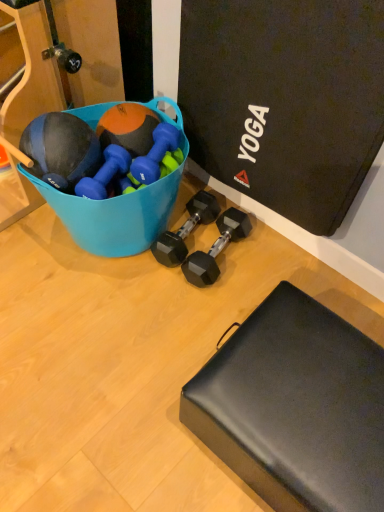
Describe the element at coordinates (158, 154) in the screenshot. Image resolution: width=384 pixels, height=512 pixels. I see `blue rubber dumbbell at center, which appears as the 3th dumbbell when viewed from the right` at that location.

Describe the element at coordinates (128, 128) in the screenshot. I see `orange matte medicine ball at upper left` at that location.

In order to face blue plastic bucket at upper left, should I rotate leftwards or rightwards?

You should look left and rotate roughly 8.744 degrees.

Measure the distance between point (145, 222) and camera.

They are 4.16 feet apart.

Describe the element at coordinates (105, 173) in the screenshot. I see `blue rubber dumbbell at center, which is counted as the fourth dumbbell, starting from the right` at that location.

Where is `black matte footrest at lower right`? This screenshot has height=512, width=384. black matte footrest at lower right is located at coordinates (295, 407).

Locate an element on the screen. This screenshot has width=384, height=512. blue rubber dumbbell at center, which appears as the 3th dumbbell when viewed from the right is located at coordinates (158, 154).

Based on the photo, from the image's perspective, is black matte footrest at lower right located above blue rubber dumbbell at center, which ranks as the first dumbbell in left-to-right order?

No, from the image's perspective, black matte footrest at lower right is not on top of blue rubber dumbbell at center, which ranks as the first dumbbell in left-to-right order.

Consider the image. Is there a large distance between black matte footrest at lower right and blue rubber dumbbell at center, which is counted as the fourth dumbbell, starting from the right?

That's not correct — black matte footrest at lower right is a little close to blue rubber dumbbell at center, which is counted as the fourth dumbbell, starting from the right.

Consider the image. Considering the relative positions of black matte footrest at lower right and blue rubber dumbbell at center, which ranks as the first dumbbell in left-to-right order, in the image provided, is black matte footrest at lower right to the left of blue rubber dumbbell at center, which ranks as the first dumbbell in left-to-right order, from the viewer's perspective?

Incorrect, black matte footrest at lower right is not on the left side of blue rubber dumbbell at center, which ranks as the first dumbbell in left-to-right order.

Considering the sizes of black matte footrest at lower right and blue rubber dumbbell at center, which is counted as the fourth dumbbell, starting from the right, in the image, is black matte footrest at lower right taller or shorter than blue rubber dumbbell at center, which is counted as the fourth dumbbell, starting from the right,?

In the image, black matte footrest at lower right appears to be taller than blue rubber dumbbell at center, which is counted as the fourth dumbbell, starting from the right.

Does black matte footrest at lower right touch orange matte medicine ball at upper left?

No, black matte footrest at lower right is not touching orange matte medicine ball at upper left.

Does point (373, 436) come closer to viewer compared to point (144, 122)?

Yes, point (373, 436) is in front of point (144, 122).

Where is `the footrest that is in front of the orange matte medicine ball at upper left`? The image size is (384, 512). the footrest that is in front of the orange matte medicine ball at upper left is located at coordinates (295, 407).

Which is more to the left, black matte footrest at lower right or orange matte medicine ball at upper left?

orange matte medicine ball at upper left is more to the left.

Who is taller, blue rubber dumbbell at center, which ranks as the second dumbbell in left-to-right order, or black rubber dumbbell at center, marked as the first dumbbell in a right-to-left arrangement?

A: With more height is black rubber dumbbell at center, marked as the first dumbbell in a right-to-left arrangement.

From the image's perspective, is blue rubber dumbbell at center, which ranks as the second dumbbell in left-to-right order, located beneath black rubber dumbbell at center, which is the 4th dumbbell in left-to-right order?

No.

Does point (178, 164) come behind point (187, 259)?

That is False.

Locate an element on the screen. the 4th dumbbell behind when counting from the black matte footrest at lower right is located at coordinates (185, 229).

Is black rubber dumbbell at center, which ranks as the third dumbbell in left-to-right order, at the back of black matte footrest at lower right?

No.

Between black matte footrest at lower right and black rubber dumbbell at center, arranged as the 2th dumbbell when viewed from the right, which one has smaller width?

black rubber dumbbell at center, arranged as the 2th dumbbell when viewed from the right, is thinner.

Who is taller, black rubber dumbbell at center, which ranks as the third dumbbell in left-to-right order, or blue plastic bucket at upper left?

blue plastic bucket at upper left is taller.

Can you see black rubber dumbbell at center, arranged as the 2th dumbbell when viewed from the right, touching blue plastic bucket at upper left?

No, black rubber dumbbell at center, arranged as the 2th dumbbell when viewed from the right, is not with blue plastic bucket at upper left.

Considering the positions of objects black rubber dumbbell at center, which ranks as the third dumbbell in left-to-right order, and blue plastic bucket at upper left in the image provided, who is behind, black rubber dumbbell at center, which ranks as the third dumbbell in left-to-right order, or blue plastic bucket at upper left?

black rubber dumbbell at center, which ranks as the third dumbbell in left-to-right order.

Does point (190, 213) appear closer or farther from the camera than point (171, 120)?

Point (190, 213) is positioned farther from the camera compared to point (171, 120).

Does point (199, 264) come farther from viewer compared to point (97, 180)?

Yes, it is.

Looking at this image, can you confirm if black rubber dumbbell at center, marked as the first dumbbell in a right-to-left arrangement, is smaller than blue rubber dumbbell at center, which is counted as the fourth dumbbell, starting from the right?

Actually, black rubber dumbbell at center, marked as the first dumbbell in a right-to-left arrangement, might be larger than blue rubber dumbbell at center, which is counted as the fourth dumbbell, starting from the right.

Are black rubber dumbbell at center, which is the 4th dumbbell in left-to-right order, and blue rubber dumbbell at center, which is counted as the fourth dumbbell, starting from the right, far apart?

Actually, black rubber dumbbell at center, which is the 4th dumbbell in left-to-right order, and blue rubber dumbbell at center, which is counted as the fourth dumbbell, starting from the right, are a little close together.

Can you confirm if black rubber dumbbell at center, marked as the first dumbbell in a right-to-left arrangement, is shorter than blue rubber dumbbell at center, which ranks as the first dumbbell in left-to-right order?

In fact, black rubber dumbbell at center, marked as the first dumbbell in a right-to-left arrangement, may be taller than blue rubber dumbbell at center, which ranks as the first dumbbell in left-to-right order.

Is orange matte medicine ball at upper left at the right side of black rubber dumbbell at center, which is the 4th dumbbell in left-to-right order?

No.

Measure the distance from orange matte medicine ball at upper left to black rubber dumbbell at center, marked as the first dumbbell in a right-to-left arrangement.

orange matte medicine ball at upper left is 15.61 inches away from black rubber dumbbell at center, marked as the first dumbbell in a right-to-left arrangement.

Is the surface of orange matte medicine ball at upper left in direct contact with black rubber dumbbell at center, marked as the first dumbbell in a right-to-left arrangement?

orange matte medicine ball at upper left and black rubber dumbbell at center, marked as the first dumbbell in a right-to-left arrangement, are clearly separated.

Is the depth of orange matte medicine ball at upper left less than that of black rubber dumbbell at center, which is the 4th dumbbell in left-to-right order?

Yes, it is in front of black rubber dumbbell at center, which is the 4th dumbbell in left-to-right order.

I want to click on the 1st dumbbell positioned above the black matte footrest at lower right (from a real-world perspective), so click(x=105, y=173).

Locate an element on the screen. This screenshot has height=512, width=384. footrest in front of the orange matte medicine ball at upper left is located at coordinates (295, 407).

Looking at the image, which one is located further to blue rubber dumbbell at center, which ranks as the second dumbbell in left-to-right order, orange matte medicine ball at upper left or black matte footrest at lower right?

The object further to blue rubber dumbbell at center, which ranks as the second dumbbell in left-to-right order, is black matte footrest at lower right.

Estimate the real-world distances between objects in this image. Which object is closer to black rubber dumbbell at center, arranged as the 2th dumbbell when viewed from the right, blue rubber dumbbell at center, which ranks as the second dumbbell in left-to-right order, or orange matte medicine ball at upper left?

Based on the image, blue rubber dumbbell at center, which ranks as the second dumbbell in left-to-right order, appears to be nearer to black rubber dumbbell at center, arranged as the 2th dumbbell when viewed from the right.

Which object lies further to the anchor point blue rubber dumbbell at center, which is counted as the fourth dumbbell, starting from the right, blue rubber dumbbell at center, which ranks as the second dumbbell in left-to-right order, or black matte footrest at lower right?

Among the two, black matte footrest at lower right is located further to blue rubber dumbbell at center, which is counted as the fourth dumbbell, starting from the right.

Which object lies nearer to the anchor point black rubber dumbbell at center, arranged as the 2th dumbbell when viewed from the right, blue rubber dumbbell at center, which ranks as the second dumbbell in left-to-right order, or blue rubber dumbbell at center, which is counted as the fourth dumbbell, starting from the right?

blue rubber dumbbell at center, which ranks as the second dumbbell in left-to-right order, is closer to black rubber dumbbell at center, arranged as the 2th dumbbell when viewed from the right.

Considering their positions, is orange matte medicine ball at upper left positioned further to black rubber dumbbell at center, marked as the first dumbbell in a right-to-left arrangement, than black rubber dumbbell at center, arranged as the 2th dumbbell when viewed from the right?

orange matte medicine ball at upper left lies further to black rubber dumbbell at center, marked as the first dumbbell in a right-to-left arrangement, than the other object.

Which object lies nearer to the anchor point black matte footrest at lower right, black rubber dumbbell at center, which is the 4th dumbbell in left-to-right order, or blue plastic bucket at upper left?

black rubber dumbbell at center, which is the 4th dumbbell in left-to-right order.

From the image, which object appears to be nearer to orange matte medicine ball at upper left, black rubber dumbbell at center, arranged as the 2th dumbbell when viewed from the right, or black matte footrest at lower right?

black rubber dumbbell at center, arranged as the 2th dumbbell when viewed from the right, is positioned closer to the anchor orange matte medicine ball at upper left.

Which object lies further to the anchor point black rubber dumbbell at center, marked as the first dumbbell in a right-to-left arrangement, orange matte medicine ball at upper left or blue rubber dumbbell at center, which is counted as the fourth dumbbell, starting from the right?

orange matte medicine ball at upper left is further to black rubber dumbbell at center, marked as the first dumbbell in a right-to-left arrangement.

Locate an element on the screen. bowl between blue rubber dumbbell at center, which ranks as the first dumbbell in left-to-right order, and black rubber dumbbell at center, marked as the first dumbbell in a right-to-left arrangement, in the horizontal direction is located at coordinates (114, 216).

This screenshot has height=512, width=384. Identify the location of bowl between orange matte medicine ball at upper left and black matte footrest at lower right vertically. (114, 216).

Find the location of `dumbbell that lies between orange matte medicine ball at upper left and blue rubber dumbbell at center, which is counted as the fourth dumbbell, starting from the right, from top to bottom`. dumbbell that lies between orange matte medicine ball at upper left and blue rubber dumbbell at center, which is counted as the fourth dumbbell, starting from the right, from top to bottom is located at coordinates (158, 154).

Image resolution: width=384 pixels, height=512 pixels. I want to click on dumbbell between blue rubber dumbbell at center, which is counted as the fourth dumbbell, starting from the right, and black rubber dumbbell at center, which ranks as the third dumbbell in left-to-right order, so click(x=158, y=154).